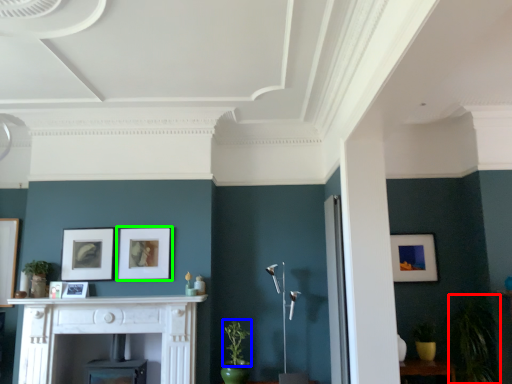
Question: Which is farther away from plant (highlighted by a red box)? plant (highlighted by a blue box) or picture frame (highlighted by a green box)?

Choices:
 (A) plant
 (B) picture frame

Answer: (B)